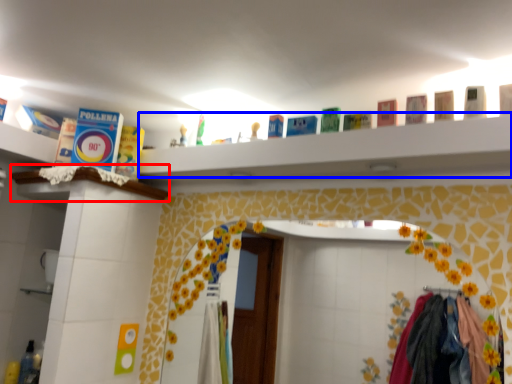
Question: Which object appears closest to the camera in this image, ledge (highlighted by a red box) or ledge (highlighted by a blue box)?

Choices:
 (A) ledge
 (B) ledge

Answer: (B)